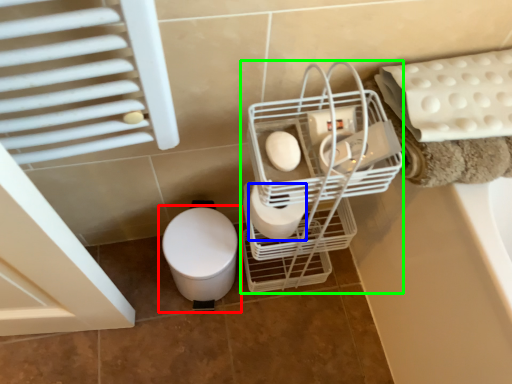
Question: Which object is the closest to the toilet (highlighted by a red box)? Choose among these: toilet paper (highlighted by a blue box) or trolley (highlighted by a green box).

Choices:
 (A) toilet paper
 (B) trolley

Answer: (A)